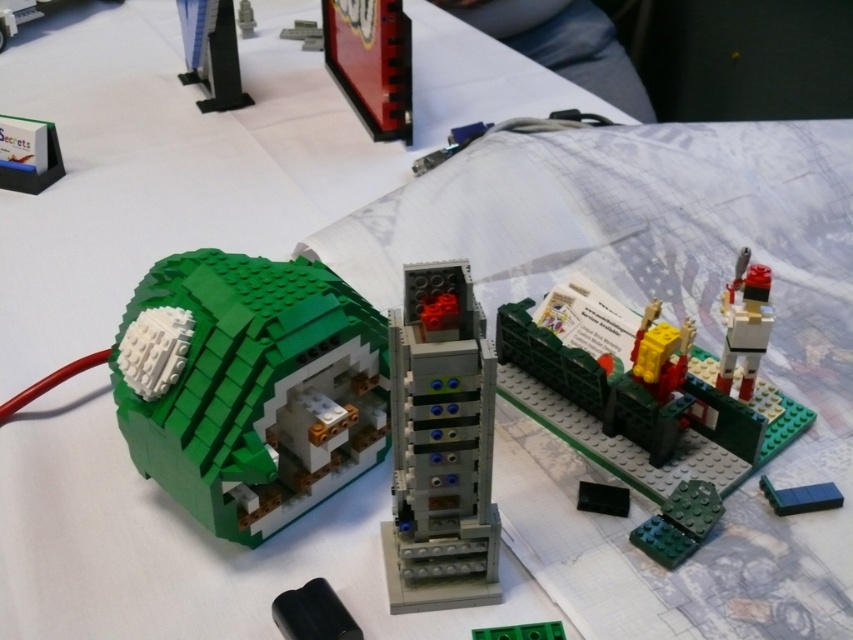
Based on the photo, does matte black nameplate at upper left appear on the right side of brushed metal bench at upper left?

Yes, matte black nameplate at upper left is to the right of brushed metal bench at upper left.

Looking at this image, is matte black nameplate at upper left taller than brushed metal bench at upper left?

No, matte black nameplate at upper left is not taller than brushed metal bench at upper left.

Who is more forward, (6, 161) or (10, 17)?

Point (6, 161) is in front.

Identify the location of matte black nameplate at upper left. The height and width of the screenshot is (640, 853). (28, 154).

Does black plastic toy at upper left appear over matte black nameplate at upper left?

Yes, black plastic toy at upper left is above matte black nameplate at upper left.

Which is above, black plastic toy at upper left or matte black nameplate at upper left?

black plastic toy at upper left is higher up.

Is point (184, 3) less distant than point (22, 168)?

No, (184, 3) is behind (22, 168).

Locate an element on the screen. This screenshot has width=853, height=640. black plastic toy at upper left is located at coordinates (212, 52).

Is point (44, 164) farther from viewer compared to point (556, 628)?

Yes.

Is point (41, 180) closer to camera compared to point (488, 634)?

No, (41, 180) is further to viewer.

You are a GUI agent. You are given a task and a screenshot of the screen. Output one action in this format:
    pyautogui.click(x=<x>, y=<y>)
    Task: Click on the matte black nameplate at upper left
    
    Given the screenshot: What is the action you would take?
    pyautogui.click(x=28, y=154)